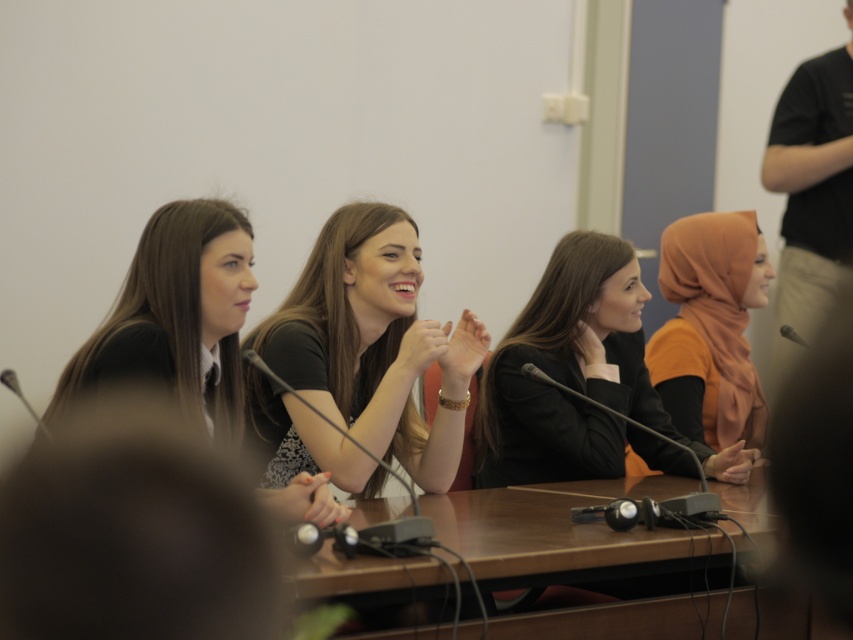
Does black matte shirt at left have a lesser height compared to orange satin hijab at right?

Correct, black matte shirt at left is not as tall as orange satin hijab at right.

Between point (173, 268) and point (758, 248), which one is positioned behind?

Positioned behind is point (758, 248).

Where is `black matte shirt at left`? The height and width of the screenshot is (640, 853). black matte shirt at left is located at coordinates (177, 316).

At what (x,y) coordinates should I click in order to perform the action: click on black matte shirt at left. Please return your answer as a coordinate pair (x, y). Looking at the image, I should click on (177, 316).

Between matte black shirt at center and matte black jacket at center, which one is positioned higher?

matte black shirt at center

Is matte black shirt at center below matte black jacket at center?

Incorrect, matte black shirt at center is not positioned below matte black jacket at center.

Identify the location of matte black shirt at center. (373, 340).

Does matte black shirt at center come in front of orange satin hijab at right?

Yes, it is in front of orange satin hijab at right.

Which of these two, matte black shirt at center or orange satin hijab at right, stands taller?

orange satin hijab at right

I want to click on matte black shirt at center, so (373, 340).

Locate an element on the screen. matte black shirt at center is located at coordinates (373, 340).